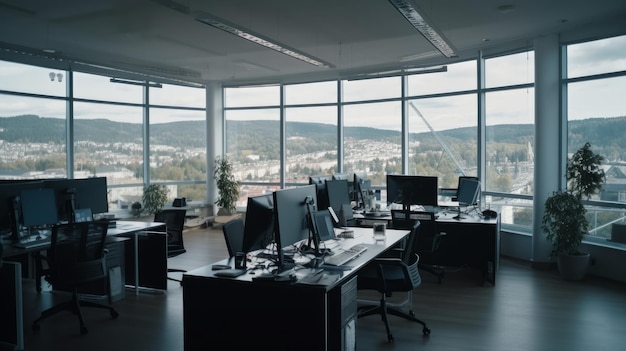
Identify the location of green plant in pot at window on right. This screenshot has height=351, width=626. (585, 166), (566, 225), (568, 206).